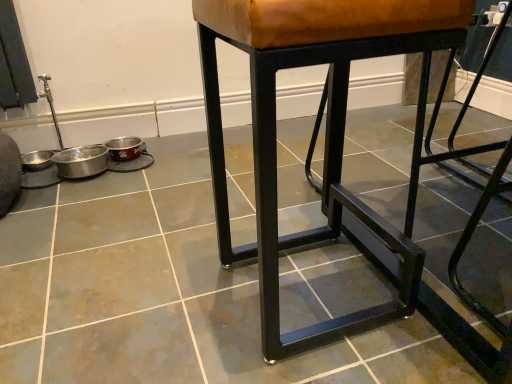
The image size is (512, 384). Find the location of `vacant point above black metal stool at center (from a real-world perspective)`. vacant point above black metal stool at center (from a real-world perspective) is located at coordinates (139, 261).